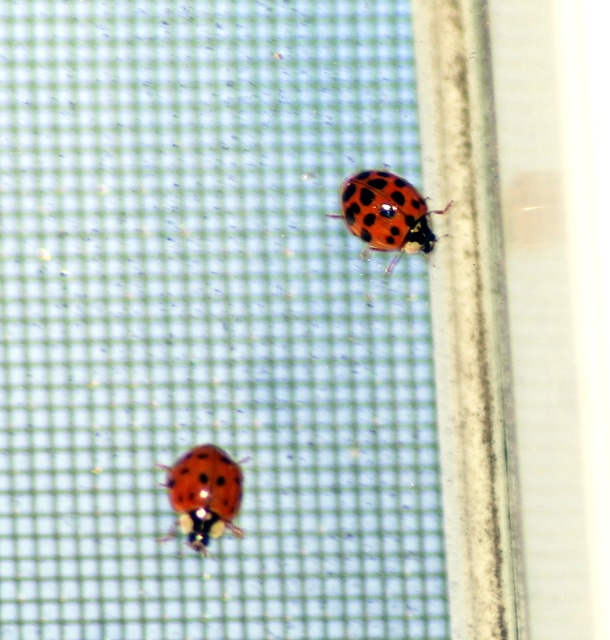
Does polka-dotted shell at upper right have a lesser width compared to shiny red beetle at lower left?

No, polka-dotted shell at upper right is not thinner than shiny red beetle at lower left.

Does polka-dotted shell at upper right appear under shiny red beetle at lower left?

Incorrect, polka-dotted shell at upper right is not positioned below shiny red beetle at lower left.

The width and height of the screenshot is (610, 640). Describe the element at coordinates (386, 212) in the screenshot. I see `polka-dotted shell at upper right` at that location.

Where is `polka-dotted shell at upper right`? polka-dotted shell at upper right is located at coordinates (386, 212).